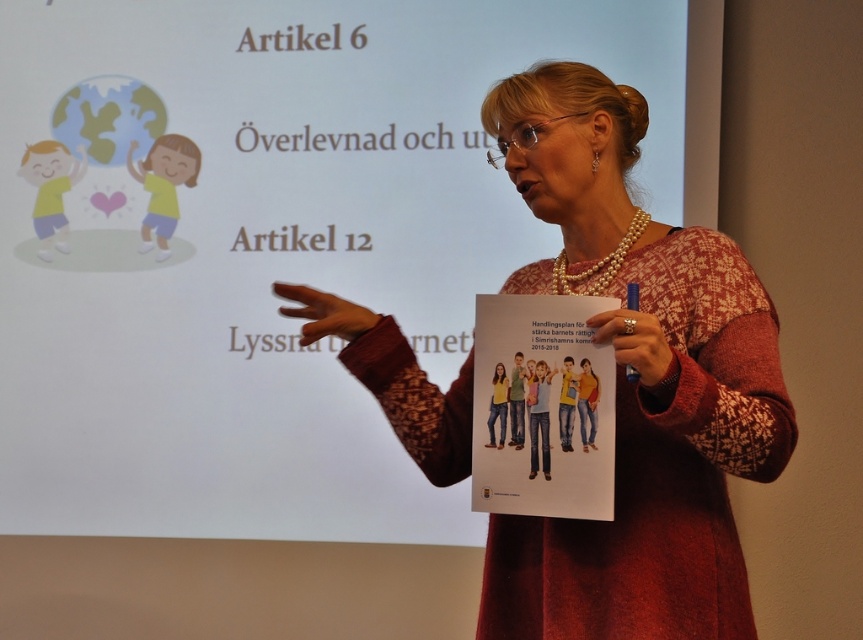
Can you confirm if white paper at center is wider than knitted sweater at center?

Indeed, white paper at center has a greater width compared to knitted sweater at center.

Which is in front, point (123, 348) or point (578, 234)?

Point (578, 234) is more forward.

Which is in front, point (656, 163) or point (728, 532)?

Point (728, 532) is more forward.

Where is `white paper at center`? The image size is (863, 640). white paper at center is located at coordinates click(262, 244).